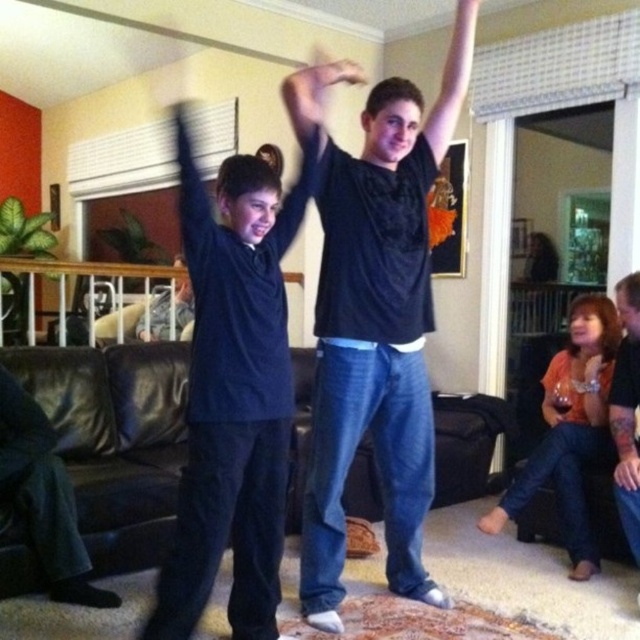
You are a delivery robot with a box that is 1.6 meters long. You need to place the box between the orange fabric shirt at lower right and the matte black shirt at upper center. Is there enough space for the box to fit horizontally between them?

The distance between the orange fabric shirt at lower right and the matte black shirt at upper center is 1.52 meters. Since the box is 1.6 meters long, it is slightly longer than the available space, so the box cannot fit horizontally between them.

You are standing in the living room and see two points marked in the scene. Which point is closer to you, point (356,77) or point (456,93)?

Point (356,77) is closer to the viewer than point (456,93).